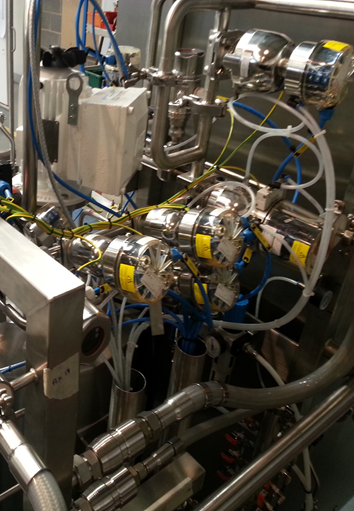
Find the location of a particular element. handle is located at coordinates (12, 41).